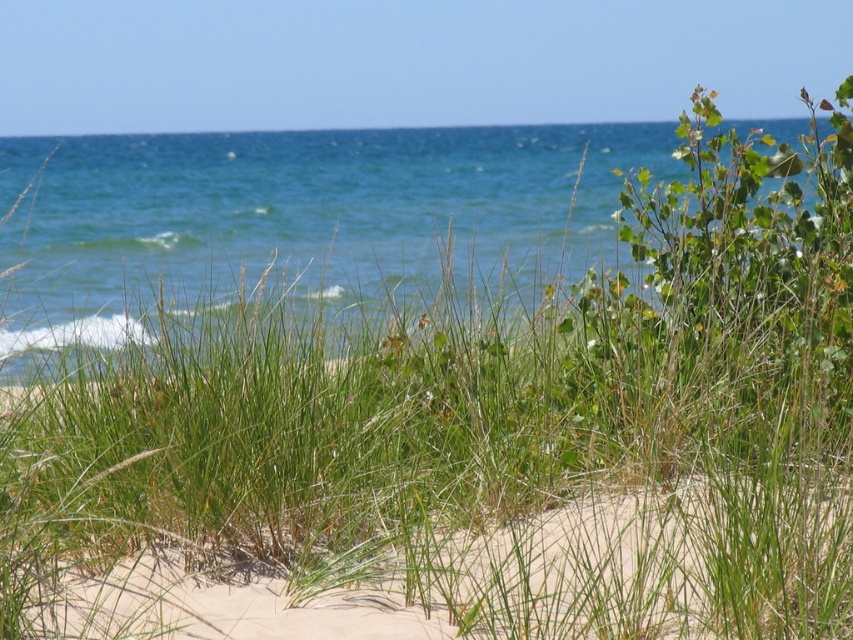
Question: Which of the following is the closest to the observer?

Choices:
 (A) (839, 618)
 (B) (33, 195)

Answer: (A)

Question: Is blue water at upper center closer to camera compared to light beige sand at lower center?

Choices:
 (A) no
 (B) yes

Answer: (A)

Question: Is blue water at upper center bigger than light beige sand at lower center?

Choices:
 (A) yes
 (B) no

Answer: (A)

Question: Which point is farther to the camera?

Choices:
 (A) light beige sand at lower center
 (B) blue water at upper center

Answer: (B)

Question: Can you confirm if blue water at upper center is positioned to the right of light beige sand at lower center?

Choices:
 (A) yes
 (B) no

Answer: (B)